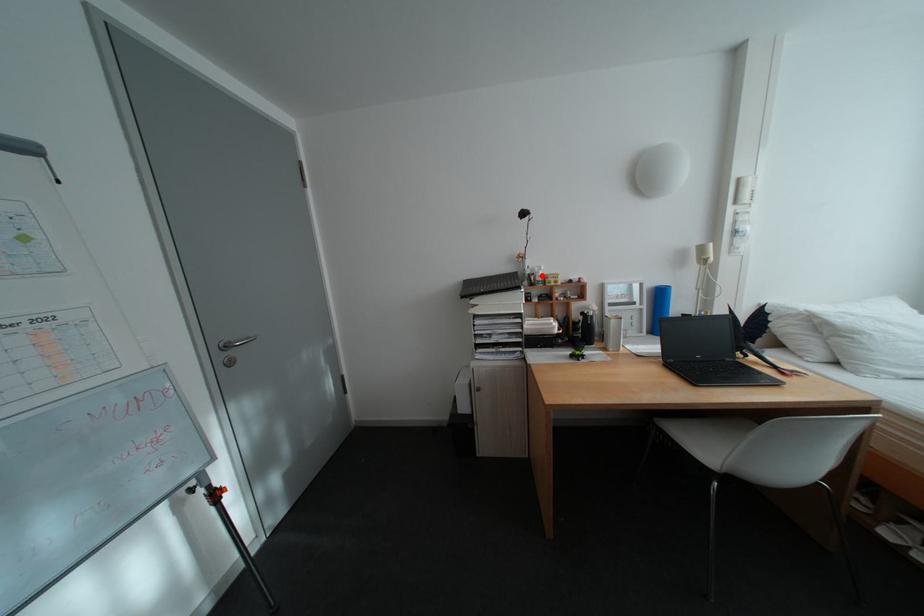
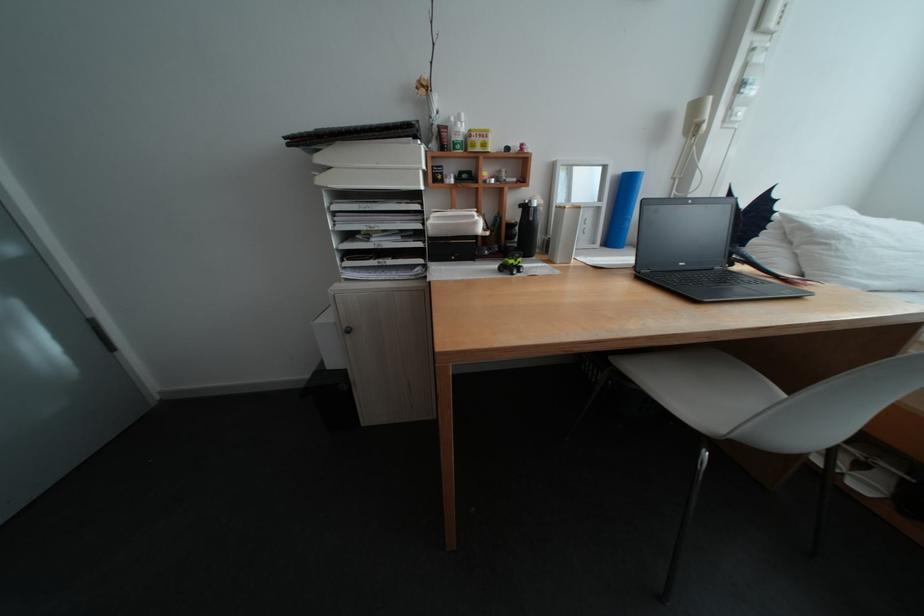
Locate, in the second image, the point that corresponds to the highlighted location in the first image.

(453, 128)